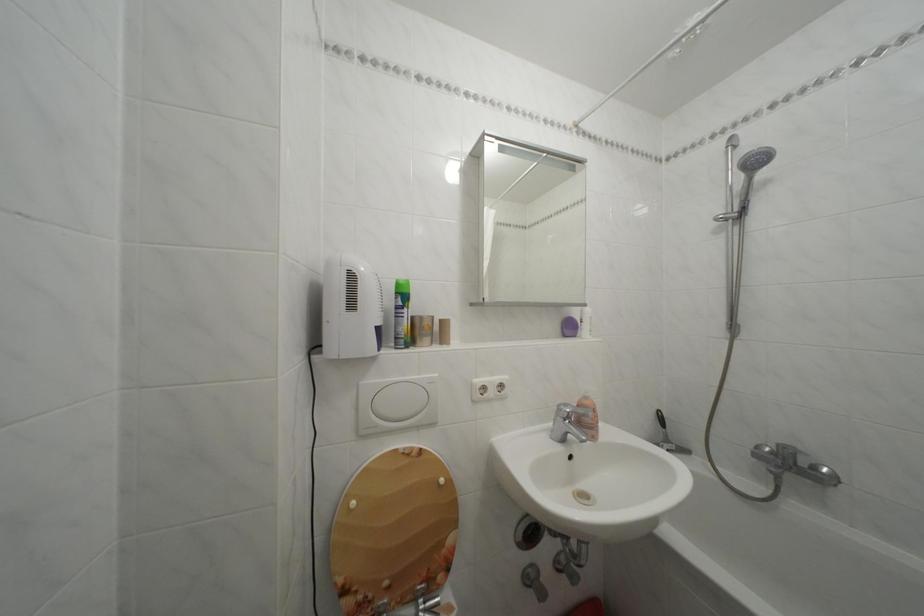
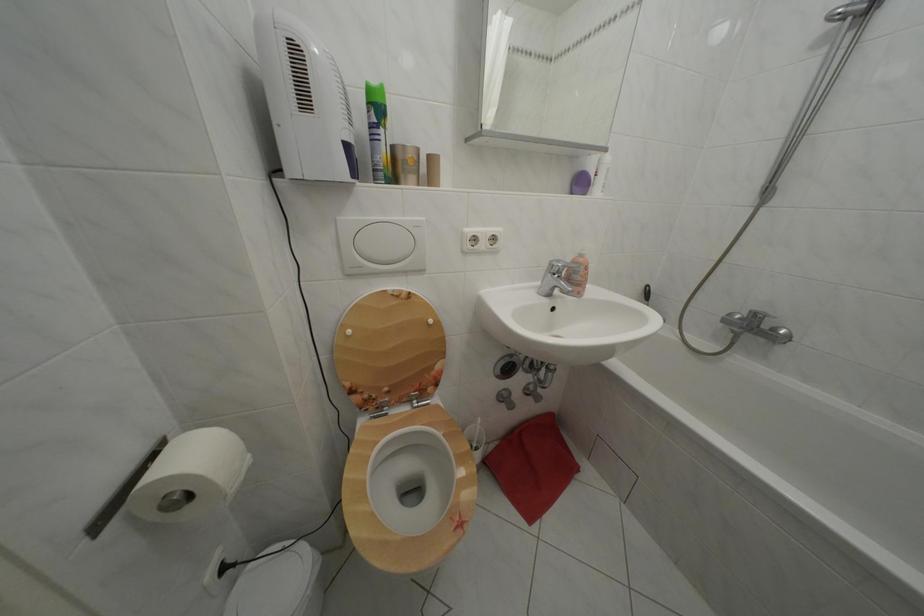
The point at [406,300] is marked in the first image. Where is the corresponding point in the second image?

(378, 110)